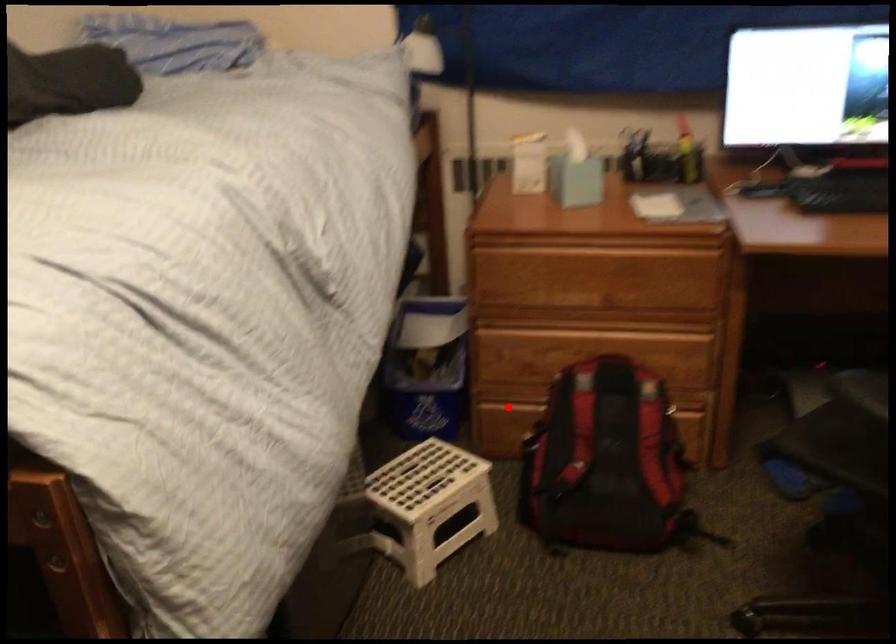
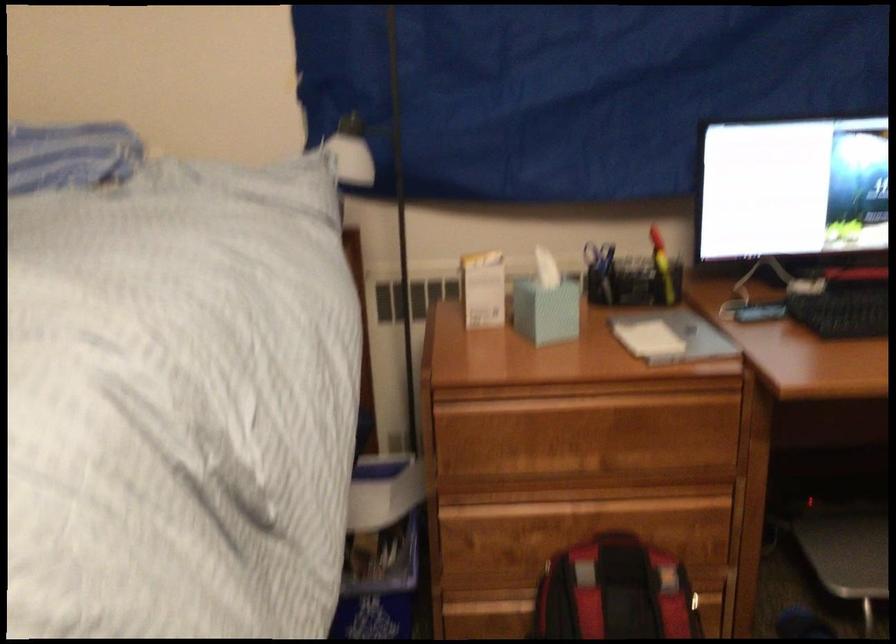
Where in the second image is the point corresponding to the highlighted location from the first image?

(478, 601)